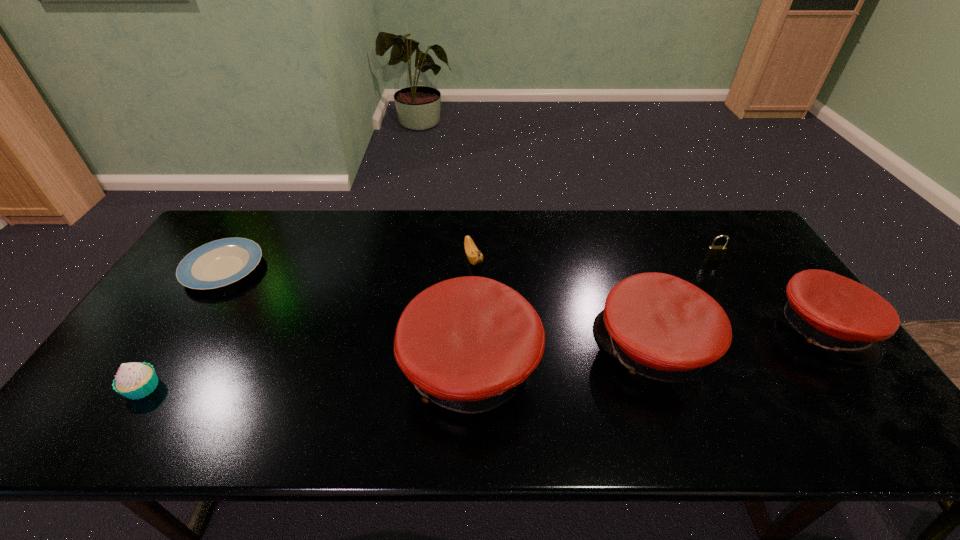
The caps are evenly distributed in the image. To maintain this, where would you place another cap on the left? Please point to a free space. Please provide its 2D coordinates. Your answer should be formatted as a tuple, i.e. [(x, y)], where the tuple contains the x and y coordinates of a point satisfying the conditions above.

[(272, 389)]